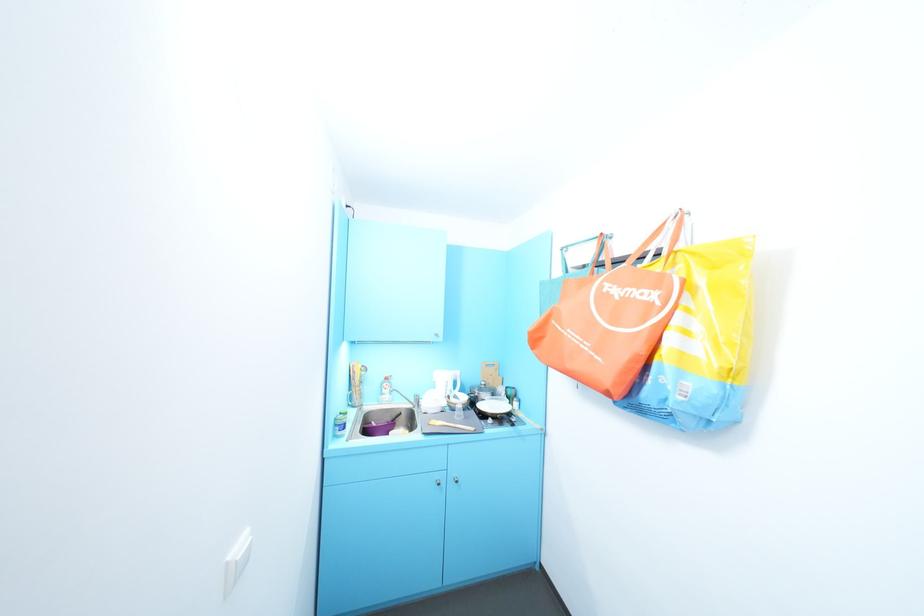
Describe the element at coordinates (682, 231) in the screenshot. This screenshot has width=924, height=616. I see `the yellow bag handle` at that location.